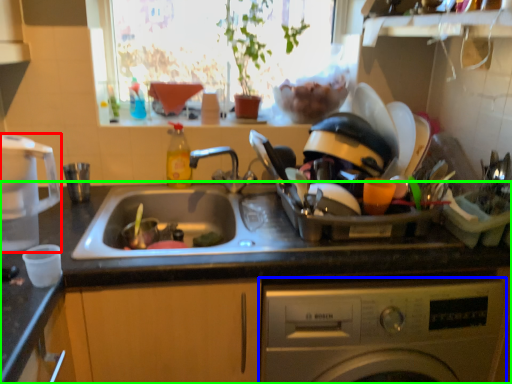
Question: Based on their relative distances, which object is farther from appliance (highlighted by a red box)? Choose from washing machine (highlighted by a blue box) and countertop (highlighted by a green box).

Choices:
 (A) washing machine
 (B) countertop

Answer: (A)